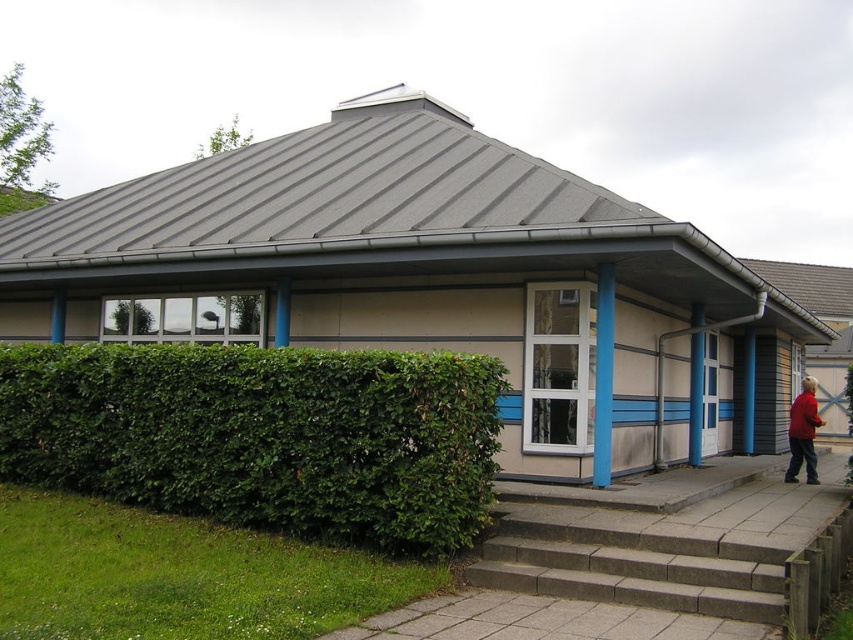
Question: Considering the real-world distances, which object is closest to the red fabric jacket at lower right?

Choices:
 (A) gray concrete stairs at lower center
 (B) green leafy hedge at lower left

Answer: (A)

Question: Can you confirm if gray concrete stairs at lower center is thinner than red fabric jacket at lower right?

Choices:
 (A) no
 (B) yes

Answer: (A)

Question: Is green leafy hedge at lower left smaller than red fabric jacket at lower right?

Choices:
 (A) no
 (B) yes

Answer: (A)

Question: Which point appears closest to the camera in this image?

Choices:
 (A) (508, 531)
 (B) (381, 381)
 (C) (793, 451)

Answer: (B)

Question: Does green leafy hedge at lower left appear over red fabric jacket at lower right?

Choices:
 (A) yes
 (B) no

Answer: (A)

Question: Based on their relative distances, which object is farther from the gray concrete stairs at lower center?

Choices:
 (A) green leafy hedge at lower left
 (B) red fabric jacket at lower right

Answer: (B)